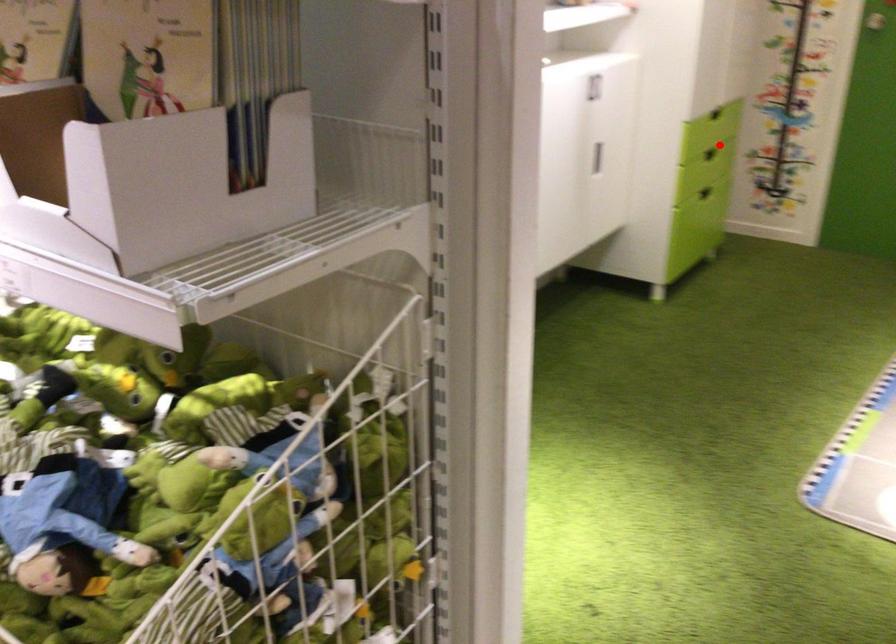
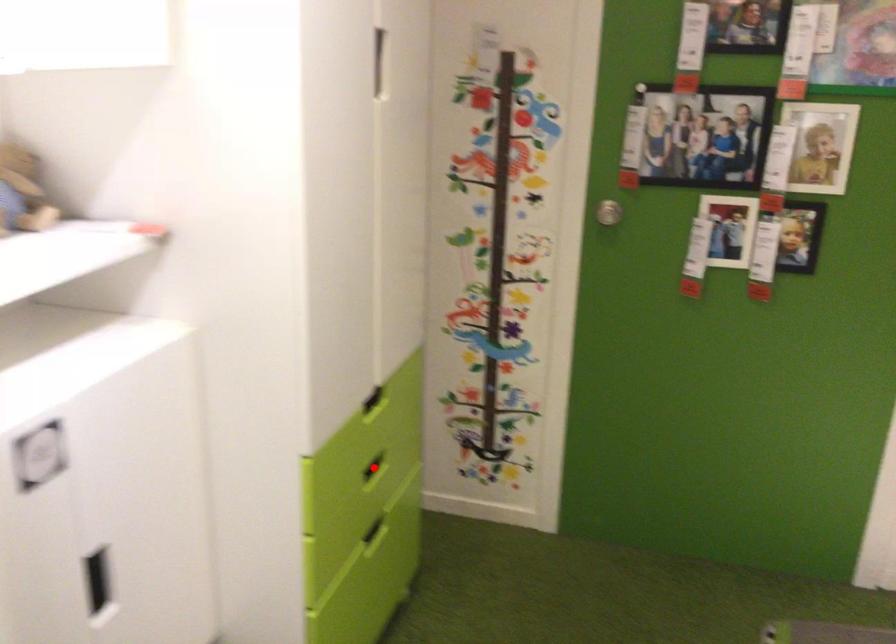
I am providing you with two images of the same scene from different viewpoints. A red point is marked on the first image and another point is marked on the second image. Do the highlighted points in image1 and image2 indicate the same real-world spot?

Yes